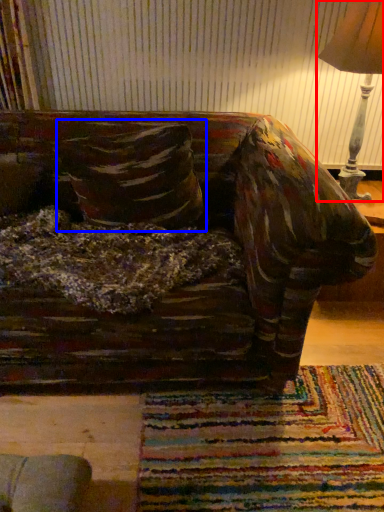
Question: Which object is further to the camera taking this photo, lamp (highlighted by a red box) or throw pillow (highlighted by a blue box)?

Choices:
 (A) lamp
 (B) throw pillow

Answer: (B)